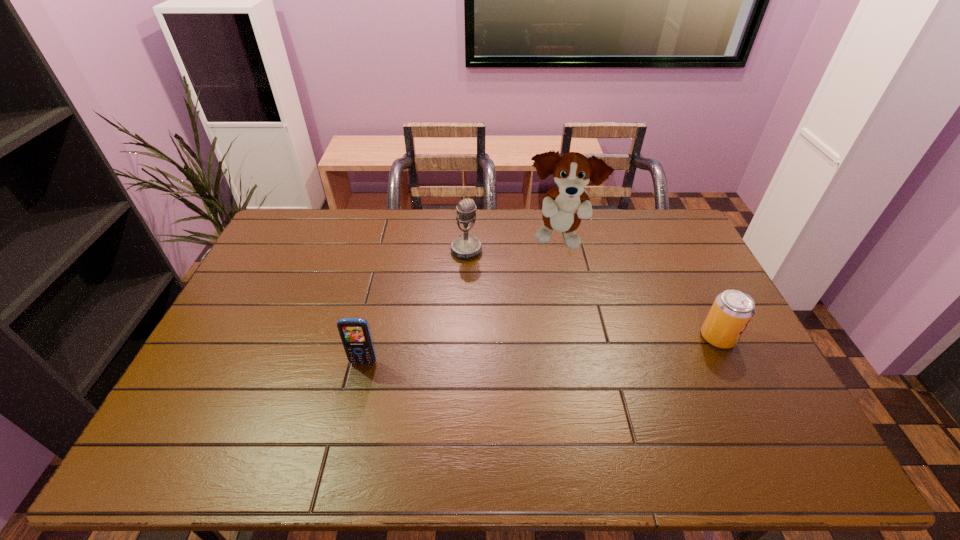
This screenshot has height=540, width=960. I want to click on free spot on the desktop that is between the cellular telephone and the shortest object and is positioned on the face of the tallest object, so click(x=595, y=346).

The width and height of the screenshot is (960, 540). I want to click on free space on the desktop that is between the leftmost object and the rightmost object and is positioned on the front-facing side of the second tallest object, so click(536, 350).